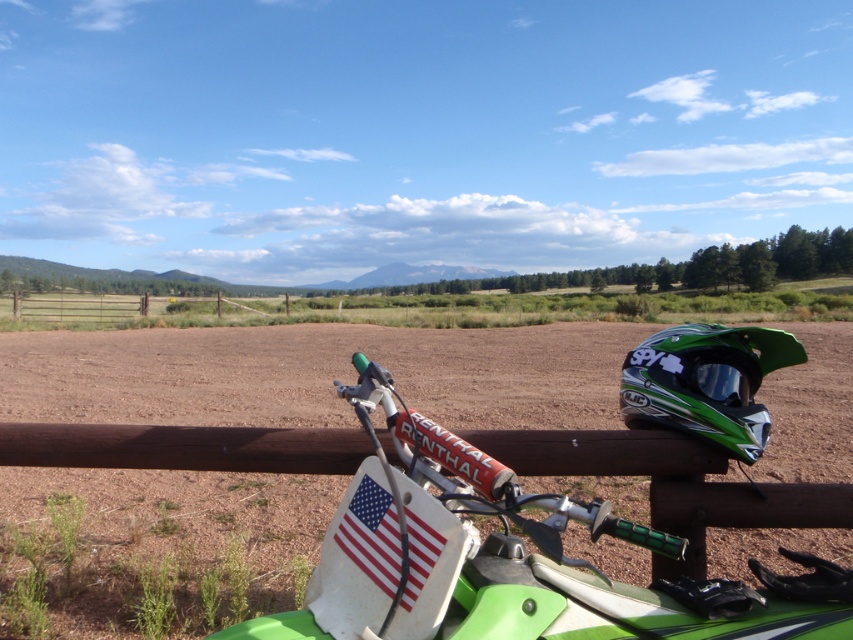
Between green matte motorcycle handlebars at center and american flag sticker at lower center, which one has less height?

With less height is american flag sticker at lower center.

Which is below, green matte motorcycle handlebars at center or american flag sticker at lower center?

green matte motorcycle handlebars at center is below.

Which is in front, point (424, 552) or point (422, 541)?

Point (424, 552) is in front.

This screenshot has width=853, height=640. Identify the location of green matte motorcycle handlebars at center. 508,557.

Can you confirm if green matte motorcycle handlebars at center is smaller than green matte helmet at upper right?

Incorrect, green matte motorcycle handlebars at center is not smaller in size than green matte helmet at upper right.

Is green matte motorcycle handlebars at center wider than green matte helmet at upper right?

Yes, green matte motorcycle handlebars at center is wider than green matte helmet at upper right.

Is point (366, 483) less distant than point (648, 426)?

Yes.

Where is `green matte motorcycle handlebars at center`? green matte motorcycle handlebars at center is located at coordinates (508, 557).

Is green matte helmet at upper right positioned behind american flag sticker at lower center?

Yes, it is behind american flag sticker at lower center.

Is green matte helmet at upper right in front of american flag sticker at lower center?

No, green matte helmet at upper right is behind american flag sticker at lower center.

The width and height of the screenshot is (853, 640). In order to click on green matte helmet at upper right in this screenshot , I will do `click(706, 381)`.